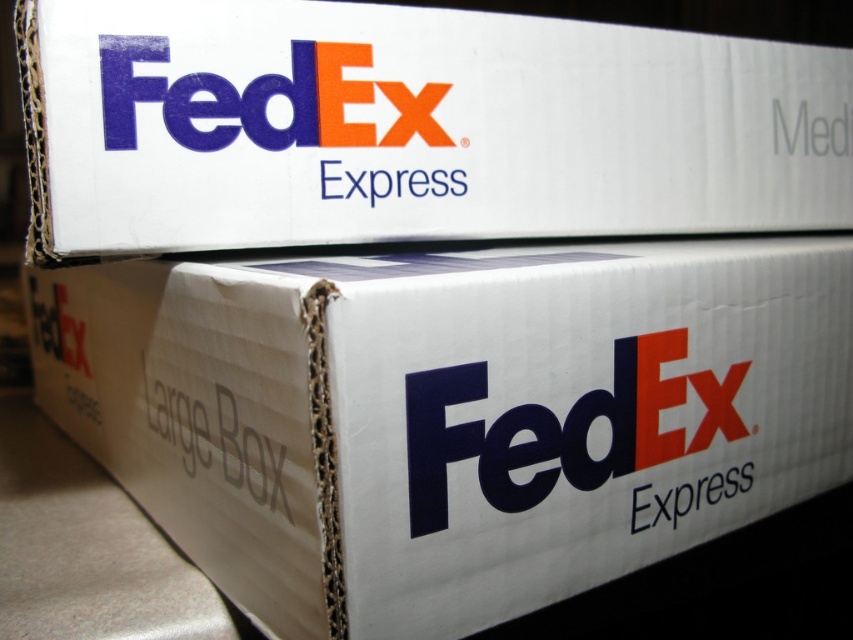
Question: Is white cardboard box at upper center to the left of matte cardboard fedex express logo at center from the viewer's perspective?

Choices:
 (A) no
 (B) yes

Answer: (B)

Question: Where is white cardboard box at center located in relation to white matte express at center in the image?

Choices:
 (A) above
 (B) below

Answer: (A)

Question: Which object appears closest to the camera in this image?

Choices:
 (A) white matte express at center
 (B) white cardboard box at upper center
 (C) matte cardboard fedex express logo at center
 (D) matte cardboard fedex logo at upper center

Answer: (C)

Question: Which of the following is the closest to the observer?

Choices:
 (A) (665, 506)
 (B) (735, 371)

Answer: (A)

Question: Can you confirm if white cardboard box at upper center is smaller than matte cardboard fedex express logo at center?

Choices:
 (A) no
 (B) yes

Answer: (A)

Question: Which point is farther to the camera?

Choices:
 (A) white cardboard box at center
 (B) white matte express at center
 (C) matte cardboard fedex logo at upper center
 (D) white cardboard box at upper center

Answer: (B)